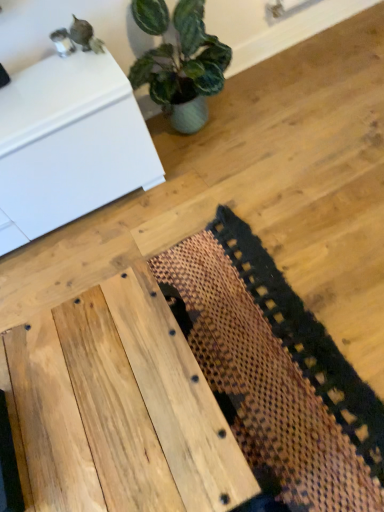
Question: Can you confirm if white glossy cabinet at upper left is smaller than brown woven mat at center?

Choices:
 (A) no
 (B) yes

Answer: (A)

Question: Is white glossy cabinet at upper left far away from brown woven mat at center?

Choices:
 (A) no
 (B) yes

Answer: (A)

Question: From the image's perspective, is white glossy cabinet at upper left located above brown woven mat at center?

Choices:
 (A) yes
 (B) no

Answer: (A)

Question: Can you confirm if white glossy cabinet at upper left is wider than brown woven mat at center?

Choices:
 (A) yes
 (B) no

Answer: (B)

Question: Is white glossy cabinet at upper left behind brown woven mat at center?

Choices:
 (A) no
 (B) yes

Answer: (B)

Question: Is natural wood table at center inside or outside of white glossy cabinet at upper left?

Choices:
 (A) inside
 (B) outside

Answer: (B)

Question: From the image's perspective, is natural wood table at center positioned above or below white glossy cabinet at upper left?

Choices:
 (A) above
 (B) below

Answer: (B)

Question: Visually, is natural wood table at center positioned to the left or to the right of white glossy cabinet at upper left?

Choices:
 (A) right
 (B) left

Answer: (A)

Question: In terms of size, does natural wood table at center appear bigger or smaller than white glossy cabinet at upper left?

Choices:
 (A) big
 (B) small

Answer: (B)

Question: Is white glossy cabinet at upper left in front of or behind brown woven mat at center in the image?

Choices:
 (A) behind
 (B) front

Answer: (A)

Question: From the image's perspective, is white glossy cabinet at upper left above or below brown woven mat at center?

Choices:
 (A) above
 (B) below

Answer: (A)

Question: Looking at their shapes, would you say white glossy cabinet at upper left is wider or thinner than brown woven mat at center?

Choices:
 (A) thin
 (B) wide

Answer: (A)

Question: From their relative heights in the image, would you say white glossy cabinet at upper left is taller or shorter than brown woven mat at center?

Choices:
 (A) short
 (B) tall

Answer: (B)

Question: Is natural wood table at center in front of or behind brown woven mat at center in the image?

Choices:
 (A) behind
 (B) front

Answer: (B)

Question: Considering the relative positions of natural wood table at center and brown woven mat at center in the image provided, is natural wood table at center to the left or to the right of brown woven mat at center?

Choices:
 (A) right
 (B) left

Answer: (B)